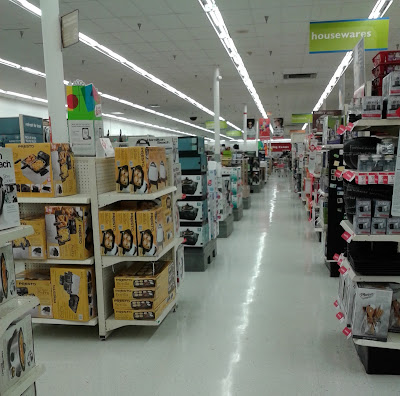
This screenshot has height=396, width=400. Identify the location of flourescent light rows. (120, 58), (126, 101), (126, 118), (233, 46), (341, 70).